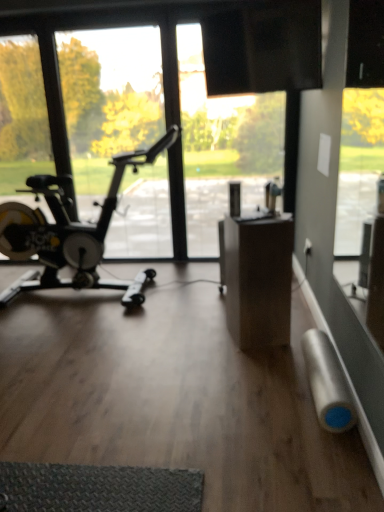
Locate an element on the screen. free space in front of black matte stationary bicycle at left is located at coordinates (168, 389).